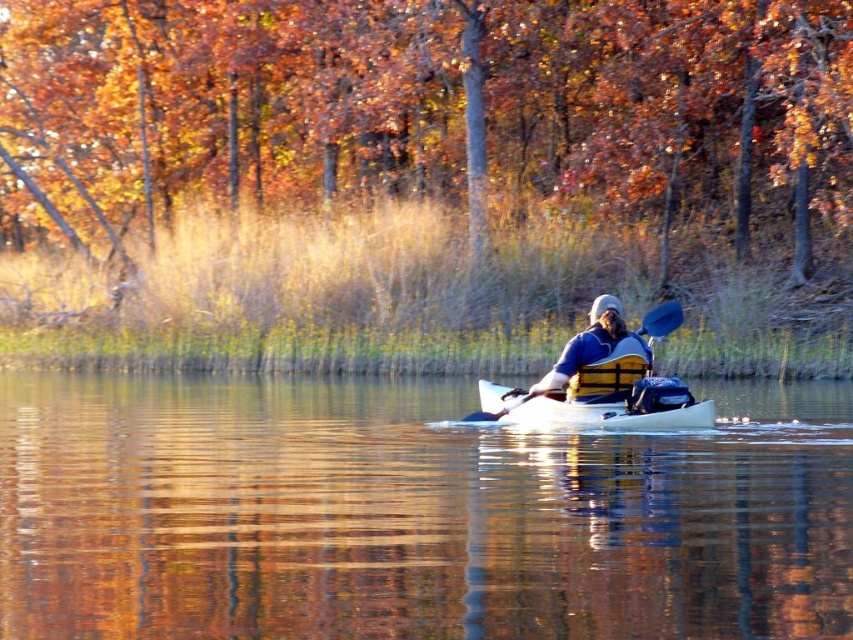
You are planning to store the white glossy kayak at center and the blue fabric life vest at center in a storage room. The storage room has a shelf that is 1.2 meters long. Can both items be placed on the shelf without overlapping?

The white glossy kayak at center is shorter than the blue fabric life vest at center. Since the total length of both items combined would exceed the shelf length of 1.2 meters, they cannot be placed side by side without overlapping.

You are planning to rent a watercraft for a family trip. You see both the white glossy kayak at center and the white matte canoe at center in the image. Which one can accommodate more passengers?

The white glossy kayak at center is larger in size than the white matte canoe at center, so it can accommodate more passengers.

You are a photographer trying to capture the kayaker in the image. You want to frame the shot so that the white glossy kayak at center and the blue fabric life vest at center are both visible. Which object should you position closer to the left side of your frame?

The white glossy kayak at center should be positioned closer to the left side of the frame because it is located to the left of the blue fabric life vest at center in the image.